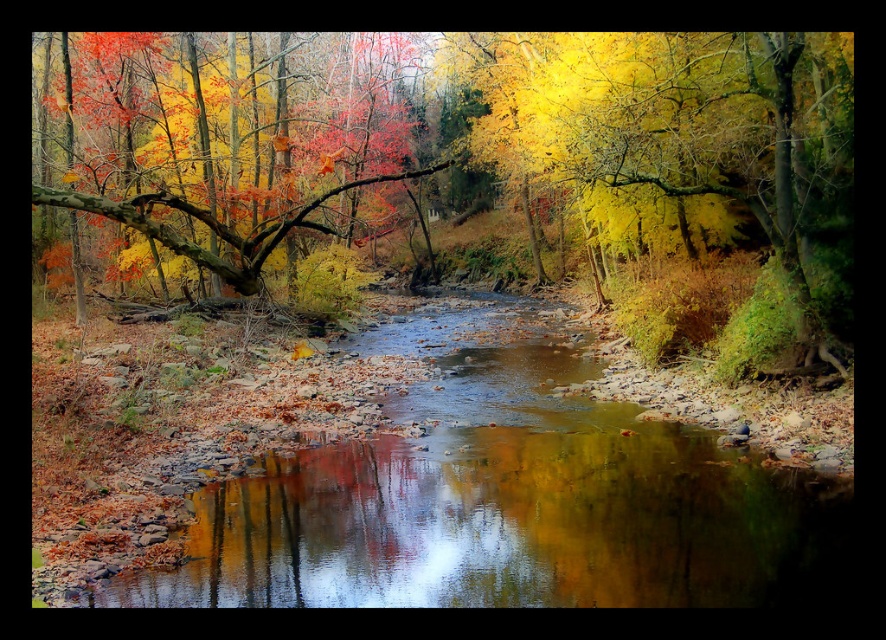
You are an artist planning to paint the autumn scene. You want to ensure that the shiny reflective water at center and the yellow matte tree at center are proportionally accurate. Which object should you paint first if you want to start with the larger one?

The yellow matte tree at center should be painted first because it occupies more space than the shiny reflective water at center according to the description.

In the autumn scene, you see the shiny reflective water at center and the smooth brown branch at upper left. Which object is positioned to the right of the other?

The shiny reflective water at center is to the right of the smooth brown branch at upper left.